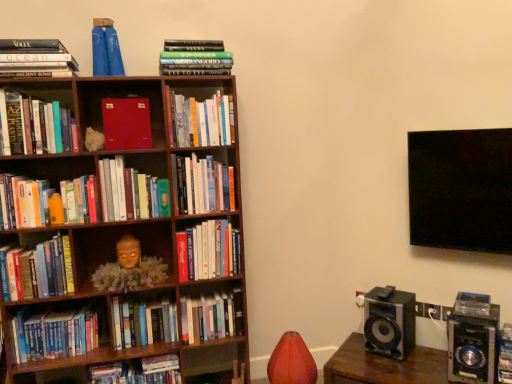
Question: From a real-world perspective, is wooden speaker at lower right under green matte book at center, which ranks as the 8th book in right-to-left order?

Choices:
 (A) no
 (B) yes

Answer: (B)

Question: Can you confirm if wooden speaker at lower right is thinner than green matte book at center, which ranks as the 8th book in right-to-left order?

Choices:
 (A) yes
 (B) no

Answer: (B)

Question: Does wooden speaker at lower right lie in front of green matte book at center, which ranks as the 8th book in left-to-right order?

Choices:
 (A) yes
 (B) no

Answer: (A)

Question: Is green matte book at center, which ranks as the 8th book in right-to-left order, at the back of wooden speaker at lower right?

Choices:
 (A) no
 (B) yes

Answer: (A)

Question: Are wooden speaker at lower right and green matte book at center, which ranks as the 8th book in left-to-right order, located far from each other?

Choices:
 (A) no
 (B) yes

Answer: (B)

Question: From a real-world perspective, relative to hardcover book at center, acting as the 11th book starting from the left, is hardcover book at center, which ranks as the 14th book in left-to-right order, vertically above or below?

Choices:
 (A) below
 (B) above

Answer: (A)

Question: Considering their positions, is hardcover book at center, which ranks as the 14th book in left-to-right order, located in front of or behind hardcover book at center, the 5th book positioned from the right?

Choices:
 (A) behind
 (B) front

Answer: (A)

Question: Do you think hardcover book at center, which ranks as the 14th book in left-to-right order, is within hardcover book at center, the 5th book positioned from the right, or outside of it?

Choices:
 (A) outside
 (B) inside

Answer: (A)

Question: In the image, is hardcover book at center, which ranks as the 14th book in left-to-right order, on the left side or the right side of hardcover book at center, acting as the 11th book starting from the left?

Choices:
 (A) left
 (B) right

Answer: (B)

Question: From a real-world perspective, is matte gold mask at center-left physically located above or below hardcover book at center, the seventh book in the left-to-right sequence?

Choices:
 (A) below
 (B) above

Answer: (B)

Question: Relative to hardcover book at center, the seventh book in the left-to-right sequence, is matte gold mask at center-left in front or behind?

Choices:
 (A) front
 (B) behind

Answer: (A)

Question: Is point (104, 289) closer or farther from the camera than point (148, 367)?

Choices:
 (A) farther
 (B) closer

Answer: (B)

Question: Looking at the image, does matte gold mask at center-left seem bigger or smaller compared to hardcover book at center, the 9th book from the right?

Choices:
 (A) small
 (B) big

Answer: (B)

Question: From a real-world perspective, relative to matte red book at center-left, acting as the sixth book starting from the left, is hardcover book at center, the 5th book positioned from the right, vertically above or below?

Choices:
 (A) above
 (B) below

Answer: (A)

Question: In terms of height, does hardcover book at center, the 5th book positioned from the right, look taller or shorter compared to matte red book at center-left, acting as the sixth book starting from the left?

Choices:
 (A) short
 (B) tall

Answer: (B)